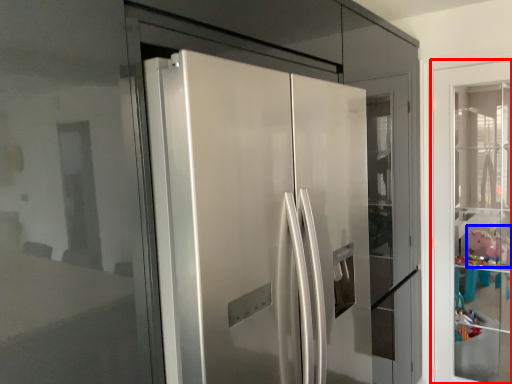
Question: Which object appears closest to the camera in this image, door (highlighted by a red box) or toy (highlighted by a blue box)?

Choices:
 (A) door
 (B) toy

Answer: (A)